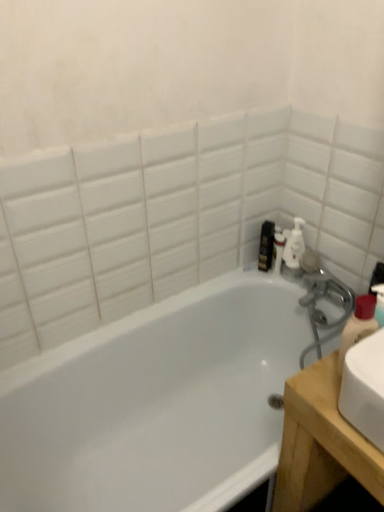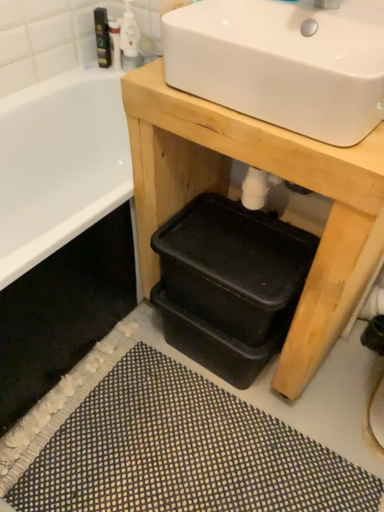
Question: How did the camera likely rotate when shooting the video?

Choices:
 (A) rotated left
 (B) rotated right

Answer: (B)